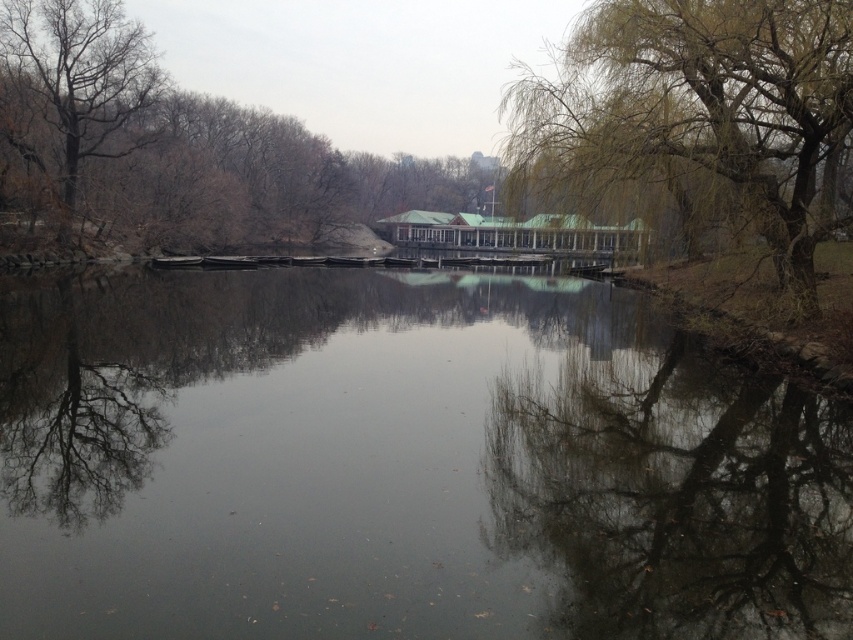
You are a landscape architect designing a new park. You want to place a statue between the smooth reflective water at center and the green textured tree at right. Considering their heights, which object should the statue be closer to in order to maintain visual balance?

The smooth reflective water at center is not as tall as green textured tree at right, so the statue should be closer to the green textured tree at right to balance the visual weight.

From the picture: You are standing in the park and want to take a photo of the smooth reflective water at center and the bare branches at upper left. Which object should you adjust your camera to focus on first if you want to capture both in one frame without moving the camera?

The smooth reflective water at center is to the right of the bare branches at upper left. To capture both in one frame without moving the camera, focus on the bare branches at upper left first since it is on the left side, allowing the right side to naturally include the smooth reflective water at center.